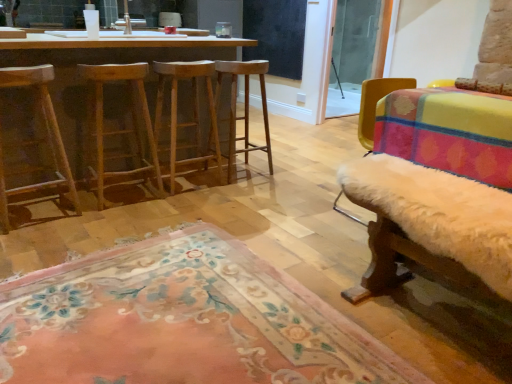
Locate an element on the screen. vacant area located to the right-hand side of light brown wood stool at center, which is the 2th stool in right-to-left order is located at coordinates (232, 190).